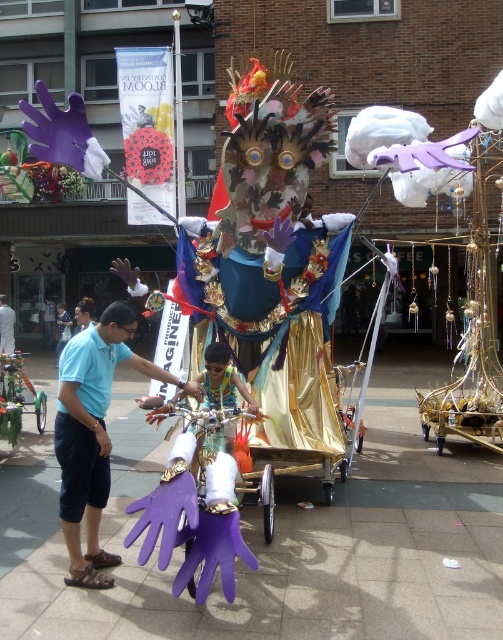
Question: Is purple rubber gloves at center wider than matte blue shirt at left?

Choices:
 (A) yes
 (B) no

Answer: (A)

Question: Can you confirm if purple rubber gloves at center is thinner than matte blue shirt at left?

Choices:
 (A) no
 (B) yes

Answer: (A)

Question: Can you confirm if purple rubber gloves at center is positioned to the right of matte blue shirt at left?

Choices:
 (A) no
 (B) yes

Answer: (B)

Question: Which point is closer to the camera?

Choices:
 (A) matte blue shirt at left
 (B) purple rubber gloves at center

Answer: (B)

Question: Among these points, which one is nearest to the camera?

Choices:
 (A) (411, 595)
 (B) (60, 406)

Answer: (A)